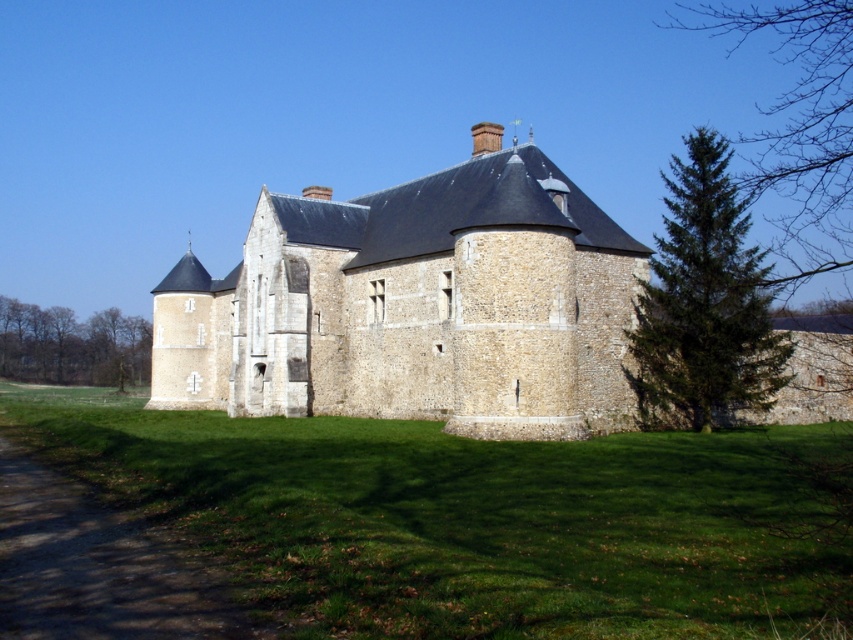
Question: Which point is farther to the camera?

Choices:
 (A) green coniferous tree at right
 (B) stone castle at center
 (C) green coniferous tree at upper right
 (D) brown textured tree at left

Answer: (D)

Question: Which of the following is the farthest from the observer?

Choices:
 (A) green coniferous tree at upper right
 (B) green coniferous tree at right
 (C) brown textured tree at left

Answer: (C)

Question: Is the position of stone castle at center more distant than that of green coniferous tree at right?

Choices:
 (A) no
 (B) yes

Answer: (B)

Question: Does green coniferous tree at upper right lie in front of brown textured tree at left?

Choices:
 (A) yes
 (B) no

Answer: (A)

Question: Which of these objects is positioned farthest from the green coniferous tree at right?

Choices:
 (A) brown textured tree at left
 (B) stone castle at center
 (C) green coniferous tree at upper right

Answer: (A)

Question: Does green coniferous tree at upper right appear over brown textured tree at left?

Choices:
 (A) yes
 (B) no

Answer: (A)